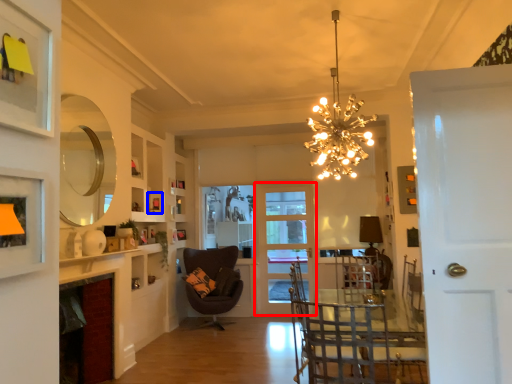
Question: Which point is closer to the camera, door (highlighted by a red box) or picture frame (highlighted by a blue box)?

Choices:
 (A) door
 (B) picture frame

Answer: (B)